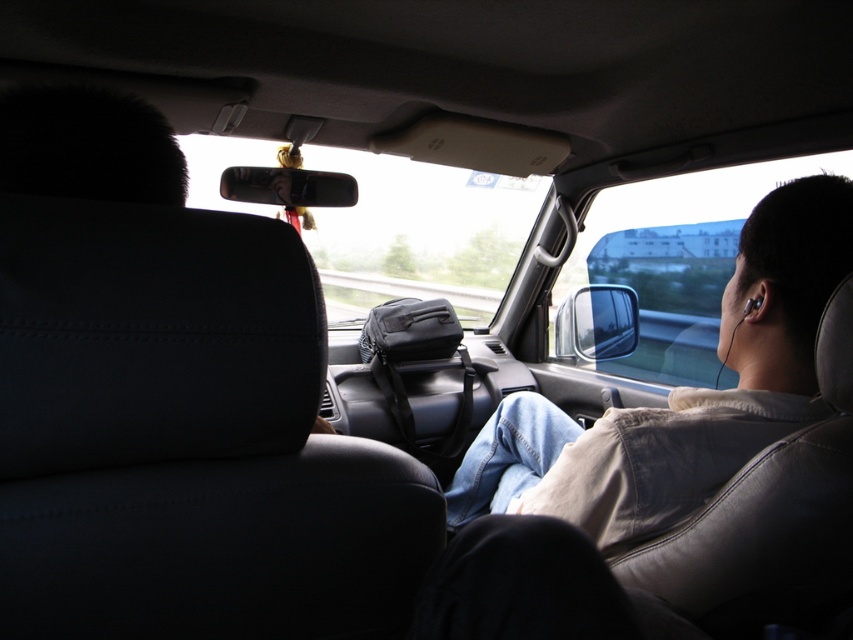
Question: Can you confirm if light brown leather jacket at right is smaller than black fur at upper left?

Choices:
 (A) no
 (B) yes

Answer: (A)

Question: Which point is closer to the camera?

Choices:
 (A) black fur at upper left
 (B) light brown leather jacket at right

Answer: (A)

Question: In this image, where is light brown leather jacket at right located relative to black fur at upper left?

Choices:
 (A) below
 (B) above

Answer: (A)

Question: Is light brown leather jacket at right to the right of black fur at upper left from the viewer's perspective?

Choices:
 (A) yes
 (B) no

Answer: (A)